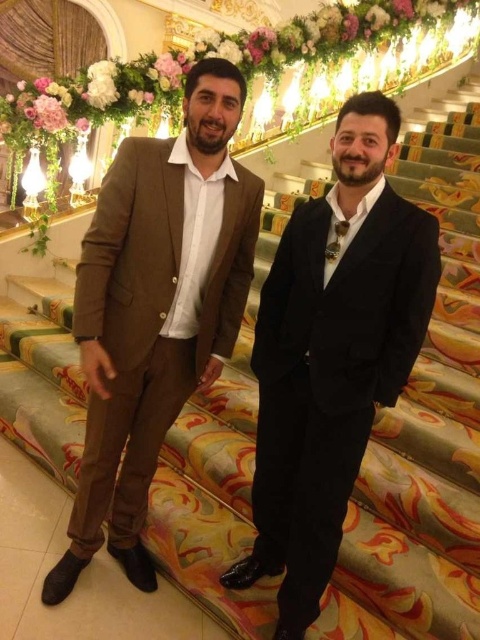
Question: Which point appears closest to the camera in this image?

Choices:
 (A) (92, 388)
 (B) (271, 536)

Answer: (A)

Question: Which object appears closest to the camera in this image?

Choices:
 (A) black satin suit at center
 (B) matte brown suit at center

Answer: (A)

Question: Does black satin suit at center appear over matte brown suit at center?

Choices:
 (A) no
 (B) yes

Answer: (A)

Question: Can you confirm if black satin suit at center is wider than matte brown suit at center?

Choices:
 (A) no
 (B) yes

Answer: (A)

Question: Can you confirm if black satin suit at center is wider than matte brown suit at center?

Choices:
 (A) yes
 (B) no

Answer: (B)

Question: Which point appears closest to the camera in this image?

Choices:
 (A) (332, 412)
 (B) (103, 244)

Answer: (A)